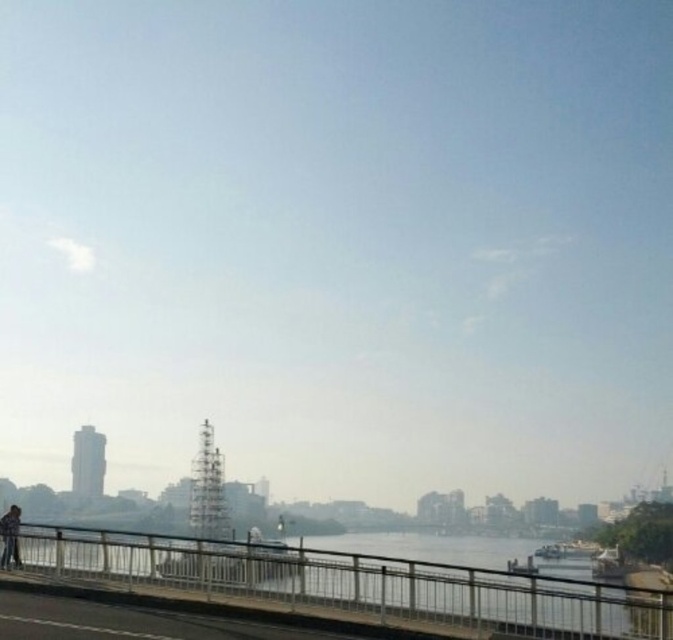
Question: Where is metallic silver railing at lower center located in relation to dark blue jeans at lower left in the image?

Choices:
 (A) below
 (B) above

Answer: (B)

Question: Which point is closer to the camera?

Choices:
 (A) (15, 509)
 (B) (240, 563)

Answer: (B)

Question: Does metallic silver railing at lower center appear on the right side of dark blue jeans at lower left?

Choices:
 (A) yes
 (B) no

Answer: (A)

Question: Which object is closer to the camera taking this photo?

Choices:
 (A) metallic silver railing at lower center
 (B) dark blue jeans at lower left

Answer: (A)

Question: Does metallic silver railing at lower center have a larger size compared to dark blue jeans at lower left?

Choices:
 (A) no
 (B) yes

Answer: (B)